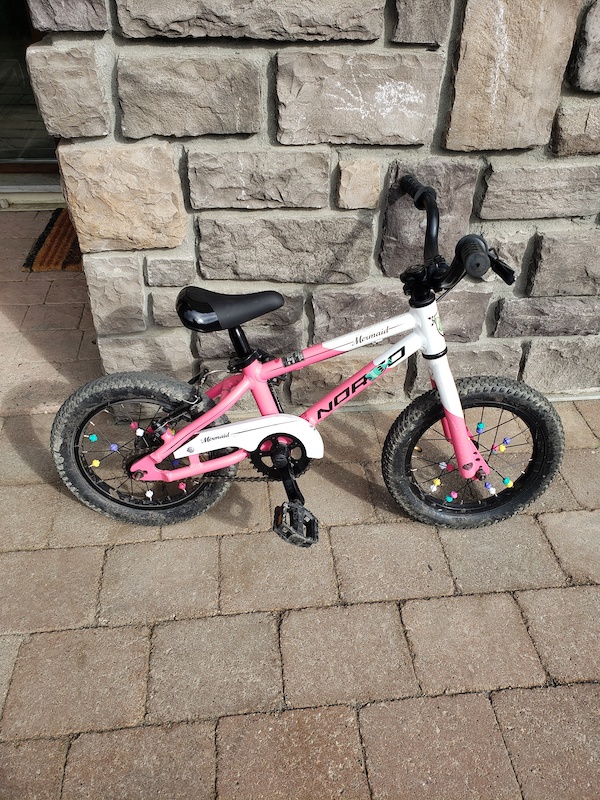
The image size is (600, 800). In order to click on doorway in this screenshot , I will do `click(24, 188)`.